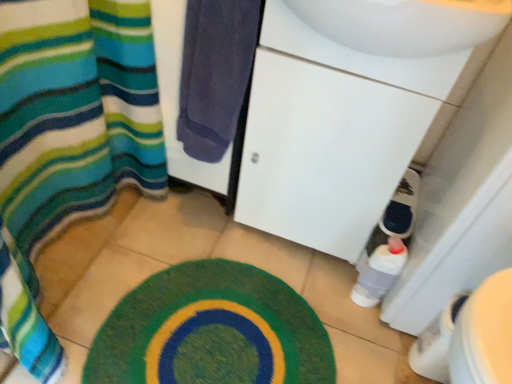
Question: Is translucent plastic bottle at lower right at the left side of white glossy sink at center?

Choices:
 (A) yes
 (B) no

Answer: (B)

Question: Is translucent plastic bottle at lower right positioned behind white glossy sink at center?

Choices:
 (A) no
 (B) yes

Answer: (B)

Question: From a real-world perspective, is translucent plastic bottle at lower right beneath white glossy sink at center?

Choices:
 (A) no
 (B) yes

Answer: (B)

Question: From the image's perspective, is translucent plastic bottle at lower right located above white glossy sink at center?

Choices:
 (A) yes
 (B) no

Answer: (B)

Question: Considering the relative positions of translucent plastic bottle at lower right and white glossy sink at center in the image provided, is translucent plastic bottle at lower right to the right of white glossy sink at center from the viewer's perspective?

Choices:
 (A) no
 (B) yes

Answer: (B)

Question: Are translucent plastic bottle at lower right and white glossy sink at center located far from each other?

Choices:
 (A) yes
 (B) no

Answer: (B)

Question: Can you confirm if translucent plastic bottle at lower right is thinner than dark blue towel at center?

Choices:
 (A) no
 (B) yes

Answer: (A)

Question: Considering the relative sizes of translucent plastic bottle at lower right and dark blue towel at center in the image provided, is translucent plastic bottle at lower right shorter than dark blue towel at center?

Choices:
 (A) yes
 (B) no

Answer: (A)

Question: Are translucent plastic bottle at lower right and dark blue towel at center making contact?

Choices:
 (A) yes
 (B) no

Answer: (B)

Question: Is translucent plastic bottle at lower right not near dark blue towel at center?

Choices:
 (A) yes
 (B) no

Answer: (B)

Question: Could you tell me if translucent plastic bottle at lower right is facing dark blue towel at center?

Choices:
 (A) yes
 (B) no

Answer: (B)

Question: Does translucent plastic bottle at lower right have a smaller size compared to dark blue towel at center?

Choices:
 (A) yes
 (B) no

Answer: (A)

Question: From a real-world perspective, is striped fabric shower curtain at left physically above translucent plastic bottle at lower right?

Choices:
 (A) no
 (B) yes

Answer: (A)